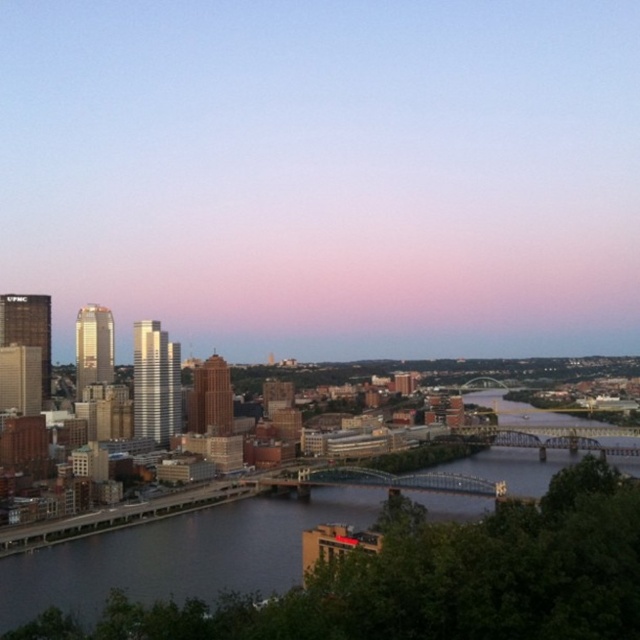
Question: Where is pink gradient sky at upper center located in relation to dark blue water at center in the image?

Choices:
 (A) right
 (B) left

Answer: (B)

Question: Which point appears farthest from the camera in this image?

Choices:
 (A) (508, 458)
 (B) (168, 257)

Answer: (B)

Question: Which point is closer to the camera?

Choices:
 (A) 365,54
 (B) 456,513

Answer: (B)

Question: Does pink gradient sky at upper center have a smaller size compared to dark blue water at center?

Choices:
 (A) yes
 (B) no

Answer: (B)

Question: Does pink gradient sky at upper center appear over dark blue water at center?

Choices:
 (A) no
 (B) yes

Answer: (B)